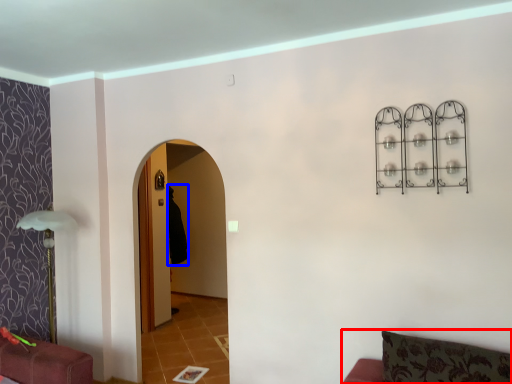
Question: Among these objects, which one is nearest to the camera, furniture (highlighted by a red box) or robe (highlighted by a blue box)?

Choices:
 (A) furniture
 (B) robe

Answer: (A)